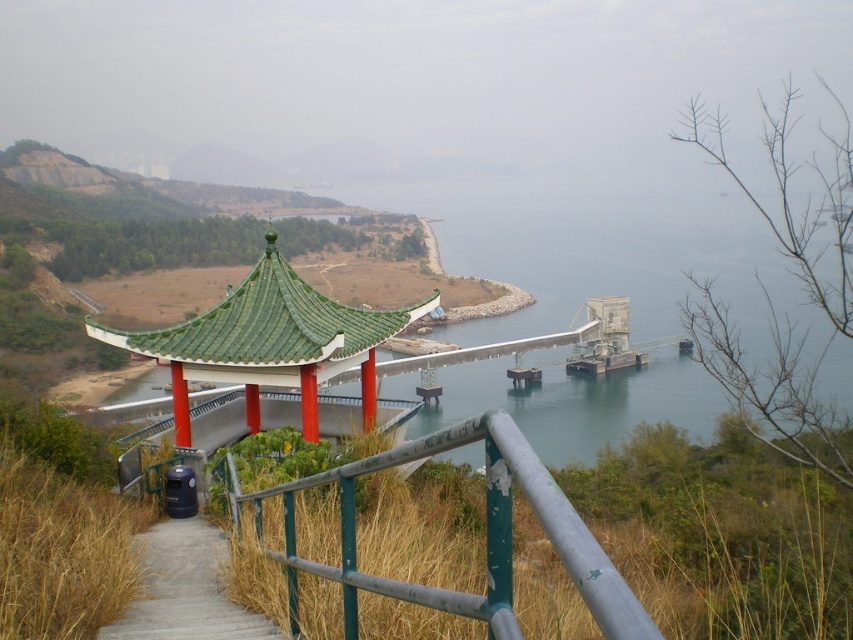
Question: Is green painted metal railing at center closer to the viewer compared to green glazed tile gazebo at center?

Choices:
 (A) yes
 (B) no

Answer: (A)

Question: Which of the following is the closest to the observer?

Choices:
 (A) (311, 422)
 (B) (209, 625)

Answer: (B)

Question: Which object appears closest to the camera in this image?

Choices:
 (A) wooden stairs at lower left
 (B) green painted metal railing at center
 (C) green glazed tile gazebo at center

Answer: (B)

Question: Can you confirm if green painted metal railing at center is positioned to the left of wooden stairs at lower left?

Choices:
 (A) yes
 (B) no

Answer: (B)

Question: Does green painted metal railing at center appear under green glazed tile gazebo at center?

Choices:
 (A) no
 (B) yes

Answer: (B)

Question: Which object is closer to the camera taking this photo?

Choices:
 (A) green glazed tile gazebo at center
 (B) green painted metal railing at center

Answer: (B)